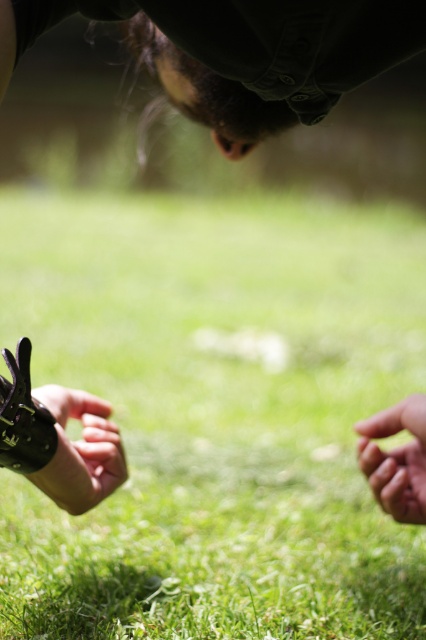
Is point (207, 548) behind point (103, 470)?

Yes, point (207, 548) is behind point (103, 470).

Does green grass at center have a lesser width compared to black matte glove at lower left?

No, green grass at center is not thinner than black matte glove at lower left.

Identify the location of green grass at center. (215, 413).

Who is positioned more to the right, black matte glove at lower left or smooth skin hand at lower right?

smooth skin hand at lower right

Measure the distance between point (98, 481) and camera.

The distance of point (98, 481) from camera is 1.21 meters.

What are the coordinates of `black matte glove at lower left` in the screenshot? It's located at (80, 451).

Does green grass at center appear over smooth skin hand at lower right?

Indeed, green grass at center is positioned over smooth skin hand at lower right.

I want to click on green grass at center, so click(x=215, y=413).